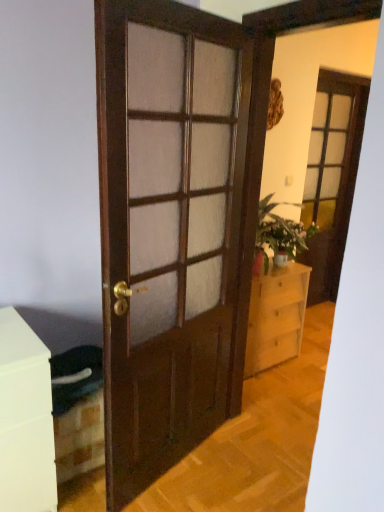
I want to click on wooden door at center, so click(x=174, y=226).

Based on the photo, what is the approximate height of matte glass screen door at upper right?

It is 2.05 meters.

Identify the location of wooden door at center. (174, 226).

Looking at this image, which object is positioned more to the right, matte glass screen door at upper right or light wood chest of drawers at center?

matte glass screen door at upper right.

Are matte glass screen door at upper right and light wood chest of drawers at center making contact?

No, matte glass screen door at upper right is not in contact with light wood chest of drawers at center.

From a real-world perspective, is matte glass screen door at upper right under light wood chest of drawers at center?

No.

From a real-world perspective, between light wood chest of drawers at center and matte pink vase at center-right, who is vertically higher?

matte pink vase at center-right, from a real-world perspective.

Which is more to the right, light wood chest of drawers at center or matte pink vase at center-right?

matte pink vase at center-right.

Is light wood chest of drawers at center not within matte pink vase at center-right?

Absolutely, light wood chest of drawers at center is external to matte pink vase at center-right.

Identify the location of door below the matte glass screen door at upper right (from a real-world perspective). This screenshot has width=384, height=512. (174, 226).

Is matte glass screen door at upper right bigger or smaller than wooden door at center?

Clearly, matte glass screen door at upper right is larger in size than wooden door at center.

Is matte glass screen door at upper right taller than wooden door at center?

Indeed, matte glass screen door at upper right has a greater height compared to wooden door at center.

Is matte glass screen door at upper right next to wooden door at center?

There is a gap between matte glass screen door at upper right and wooden door at center.

Looking at this image, between wooden door at center and matte pink vase at center-right, which one appears on the right side from the viewer's perspective?

From the viewer's perspective, matte pink vase at center-right appears more on the right side.

Who is shorter, wooden door at center or matte pink vase at center-right?

matte pink vase at center-right is shorter.

Is the position of wooden door at center more distant than that of matte pink vase at center-right?

No, the depth of wooden door at center is less than that of matte pink vase at center-right.

Is wooden door at center positioned with its back to matte pink vase at center-right?

No, wooden door at center is not facing away from matte pink vase at center-right.

Looking at this image, does wooden door at center contain matte glass screen door at upper right?

No, matte glass screen door at upper right is located outside of wooden door at center.

Can you confirm if wooden door at center is shorter than matte glass screen door at upper right?

Yes, wooden door at center is shorter than matte glass screen door at upper right.

From the image's perspective, is wooden door at center above matte glass screen door at upper right?

No, from the image's perspective, wooden door at center is not above matte glass screen door at upper right.

Based on the photo, which is nearer, (236, 104) or (310, 290)?

Point (236, 104) is positioned closer to the camera compared to point (310, 290).

Is point (307, 231) closer or farther from the camera than point (198, 159)?

Point (307, 231).

Where is `door on the left of matte pink vase at center-right`? The width and height of the screenshot is (384, 512). door on the left of matte pink vase at center-right is located at coordinates (174, 226).

From a real-world perspective, relative to wooden door at center, is matte pink vase at center-right vertically above or below?

Clearly, from a real-world perspective, matte pink vase at center-right is below wooden door at center.

Is matte pink vase at center-right not close to wooden door at center?

No, matte pink vase at center-right is not far away from wooden door at center.

Is matte glass screen door at upper right spatially inside matte pink vase at center-right, or outside of it?

matte glass screen door at upper right is located beyond the bounds of matte pink vase at center-right.

Is matte glass screen door at upper right oriented towards matte pink vase at center-right?

No, matte glass screen door at upper right does not turn towards matte pink vase at center-right.

Considering the sizes of objects matte glass screen door at upper right and matte pink vase at center-right in the image provided, who is wider, matte glass screen door at upper right or matte pink vase at center-right?

matte pink vase at center-right is wider.

Looking at the image, does matte glass screen door at upper right seem bigger or smaller compared to matte pink vase at center-right?

matte glass screen door at upper right is bigger than matte pink vase at center-right.

At what (x,y) coordinates should I click in order to perform the action: click on the chest of drawers that is in front of the matte glass screen door at upper right. Please return your answer as a coordinate pair (x, y). Image resolution: width=384 pixels, height=512 pixels. Looking at the image, I should click on (276, 317).

The height and width of the screenshot is (512, 384). Find the location of `the chest of drawers that is below the matte pink vase at center-right (from the image's perspective)`. the chest of drawers that is below the matte pink vase at center-right (from the image's perspective) is located at coordinates (276, 317).

Which object lies further to the anchor point matte glass screen door at upper right, wooden door at center or light wood chest of drawers at center?

The object further to matte glass screen door at upper right is wooden door at center.

Looking at the image, which one is located further to matte pink vase at center-right, light wood chest of drawers at center or wooden door at center?

wooden door at center.

Considering their positions, is wooden door at center positioned further to matte pink vase at center-right than light wood chest of drawers at center?

wooden door at center lies further to matte pink vase at center-right than the other object.

Based on their spatial positions, is matte glass screen door at upper right or matte pink vase at center-right closer to wooden door at center?

matte pink vase at center-right lies closer to wooden door at center than the other object.

Considering their positions, is light wood chest of drawers at center positioned further to matte glass screen door at upper right than wooden door at center?

Among the two, wooden door at center is located further to matte glass screen door at upper right.

Considering their positions, is matte pink vase at center-right positioned closer to matte glass screen door at upper right than light wood chest of drawers at center?

matte pink vase at center-right is closer to matte glass screen door at upper right.

When comparing their distances from matte pink vase at center-right, does matte glass screen door at upper right or wooden door at center seem further?

wooden door at center.

Which object lies nearer to the anchor point light wood chest of drawers at center, matte pink vase at center-right or wooden door at center?

matte pink vase at center-right.

Identify the location of houseplant between matte glass screen door at upper right and light wood chest of drawers at center in the vertical direction. (280, 232).

This screenshot has height=512, width=384. In order to click on houseplant between wooden door at center and matte glass screen door at upper right along the z-axis in this screenshot , I will do 280,232.

Identify the location of the chest of drawers positioned between wooden door at center and matte pink vase at center-right from near to far. This screenshot has width=384, height=512. (276, 317).

The width and height of the screenshot is (384, 512). I want to click on chest of drawers between wooden door at center and matte glass screen door at upper right in the front-back direction, so click(x=276, y=317).